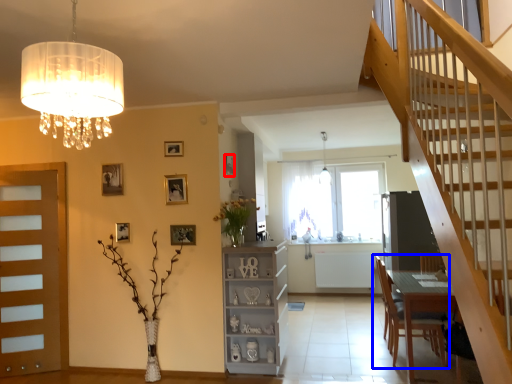
Question: Which of the following is the farthest to the observer, picture frame (highlighted by a red box) or chair (highlighted by a blue box)?

Choices:
 (A) picture frame
 (B) chair

Answer: (A)